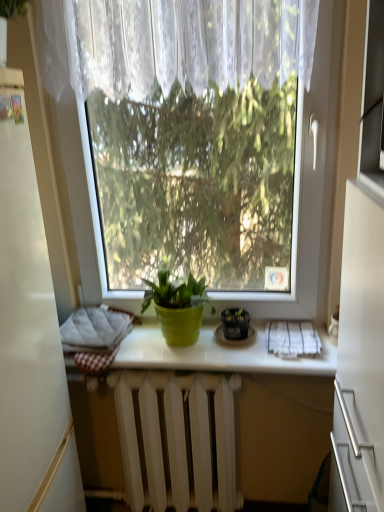
Question: From a real-world perspective, does matte black pot at center, acting as the 2th houseplant starting from the left, sit lower than white textured cloth at lower right?

Choices:
 (A) no
 (B) yes

Answer: (A)

Question: Is matte black pot at center, acting as the 2th houseplant starting from the left, smaller than white textured cloth at lower right?

Choices:
 (A) no
 (B) yes

Answer: (A)

Question: From a real-world perspective, is matte black pot at center, acting as the 2th houseplant starting from the left, on white textured cloth at lower right?

Choices:
 (A) yes
 (B) no

Answer: (A)

Question: From the image's perspective, does matte black pot at center, which is the first houseplant from right to left, appear higher than white textured cloth at lower right?

Choices:
 (A) yes
 (B) no

Answer: (A)

Question: Can you confirm if matte black pot at center, acting as the 2th houseplant starting from the left, is shorter than white textured cloth at lower right?

Choices:
 (A) no
 (B) yes

Answer: (A)

Question: Relative to green matte pot at center, is transparent glass window at center in front or behind?

Choices:
 (A) behind
 (B) front

Answer: (B)

Question: From a real-world perspective, is transparent glass window at center positioned above or below green matte pot at center?

Choices:
 (A) above
 (B) below

Answer: (A)

Question: From the image's perspective, is transparent glass window at center positioned above or below green matte pot at center?

Choices:
 (A) below
 (B) above

Answer: (B)

Question: Looking at the image, does transparent glass window at center seem bigger or smaller compared to green matte pot at center?

Choices:
 (A) small
 (B) big

Answer: (B)

Question: In terms of width, does matte black pot at center, acting as the 2th houseplant starting from the left, look wider or thinner when compared to green matte pot at center, which is the 1th houseplant from left to right?

Choices:
 (A) thin
 (B) wide

Answer: (A)

Question: Considering the positions of point (236, 324) and point (208, 296), is point (236, 324) closer or farther from the camera than point (208, 296)?

Choices:
 (A) farther
 (B) closer

Answer: (B)

Question: Is matte black pot at center, acting as the 2th houseplant starting from the left, taller or shorter than green matte pot at center, which is the 1th houseplant from left to right?

Choices:
 (A) tall
 (B) short

Answer: (B)

Question: From the image's perspective, relative to green matte pot at center, which is counted as the second houseplant, starting from the right, is matte black pot at center, acting as the 2th houseplant starting from the left, above or below?

Choices:
 (A) above
 (B) below

Answer: (B)

Question: From a real-world perspective, is white painted metal radiator at center above or below green matte pot at center, which is the 1th houseplant from left to right?

Choices:
 (A) below
 (B) above

Answer: (A)

Question: Does point (115, 385) appear closer or farther from the camera than point (185, 325)?

Choices:
 (A) farther
 (B) closer

Answer: (A)